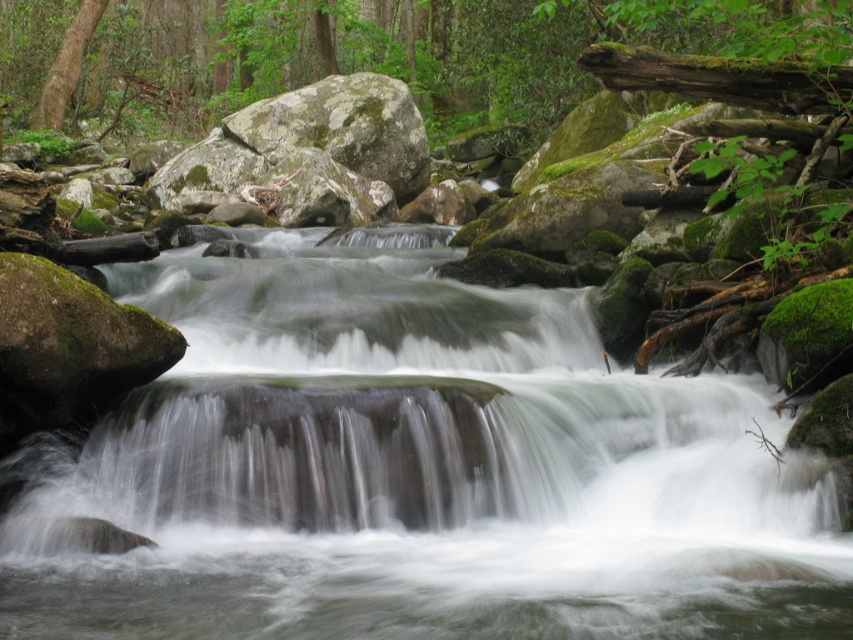
Question: Does clear water at center have a lesser width compared to green mossy rock at upper center?

Choices:
 (A) no
 (B) yes

Answer: (B)

Question: Does clear water at center lie in front of green mossy rock at upper center?

Choices:
 (A) no
 (B) yes

Answer: (B)

Question: Which point is farther from the camera taking this photo?

Choices:
 (A) (144, 97)
 (B) (786, 544)

Answer: (A)

Question: Which object is farther from the camera taking this photo?

Choices:
 (A) green mossy rock at upper center
 (B) clear water at center

Answer: (A)

Question: Among these points, which one is nearest to the camera?

Choices:
 (A) (99, 508)
 (B) (103, 90)

Answer: (A)

Question: Can you confirm if clear water at center is thinner than green mossy rock at upper center?

Choices:
 (A) no
 (B) yes

Answer: (B)